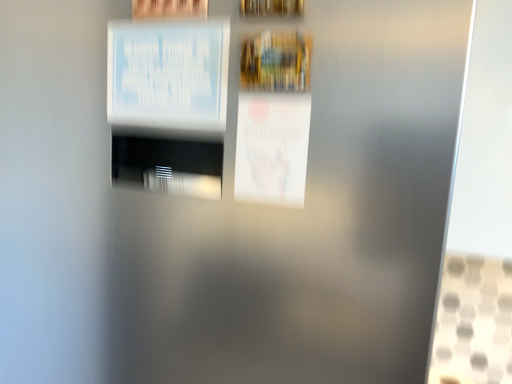
Question: Is wooden picture frame at upper center aimed at white paper poster at center, which appears as the second poster when viewed from the left?

Choices:
 (A) yes
 (B) no

Answer: (B)

Question: Could white paper poster at center, which appears as the second poster when viewed from the left, be considered to be inside wooden picture frame at upper center?

Choices:
 (A) yes
 (B) no

Answer: (B)

Question: Does wooden picture frame at upper center have a larger size compared to white paper poster at center, marked as the 1th poster in a bottom-to-top arrangement?

Choices:
 (A) no
 (B) yes

Answer: (A)

Question: Does wooden picture frame at upper center have a lesser height compared to white paper poster at center, which appears as the second poster when viewed from the left?

Choices:
 (A) no
 (B) yes

Answer: (B)

Question: From a real-world perspective, does wooden picture frame at upper center stand above white paper poster at center, which appears as the second poster when viewed from the left?

Choices:
 (A) yes
 (B) no

Answer: (A)

Question: From the image's perspective, is white paper poster at center, marked as the 1th poster in a bottom-to-top arrangement, above or below white paper at upper left, arranged as the second poster when ordered from the bottom?

Choices:
 (A) below
 (B) above

Answer: (A)

Question: From a real-world perspective, is white paper poster at center, which is counted as the first poster, starting from the right, positioned above or below white paper at upper left, the 1th poster positioned from the left?

Choices:
 (A) below
 (B) above

Answer: (A)

Question: Considering their positions, is white paper poster at center, which is counted as the first poster, starting from the right, located in front of or behind white paper at upper left, the first poster from the top?

Choices:
 (A) front
 (B) behind

Answer: (A)

Question: Looking at their shapes, would you say white paper poster at center, marked as the 1th poster in a bottom-to-top arrangement, is wider or thinner than white paper at upper left, the first poster from the top?

Choices:
 (A) thin
 (B) wide

Answer: (A)

Question: Is white paper poster at center, which is counted as the first poster, starting from the right, wider or thinner than wooden picture frame at upper center?

Choices:
 (A) thin
 (B) wide

Answer: (A)

Question: Considering their positions, is white paper poster at center, which is counted as the first poster, starting from the right, located in front of or behind wooden picture frame at upper center?

Choices:
 (A) front
 (B) behind

Answer: (B)

Question: Is point (243, 183) positioned closer to the camera than point (274, 3)?

Choices:
 (A) closer
 (B) farther

Answer: (B)

Question: From a real-world perspective, is white paper poster at center, which appears as the second poster when viewed from the left, physically located above or below wooden picture frame at upper center?

Choices:
 (A) below
 (B) above

Answer: (A)

Question: In terms of width, does wooden picture frame at upper center look wider or thinner when compared to white paper at upper left, the first poster from the top?

Choices:
 (A) thin
 (B) wide

Answer: (B)

Question: Would you say wooden picture frame at upper center is inside or outside white paper at upper left, arranged as the second poster when ordered from the bottom?

Choices:
 (A) outside
 (B) inside

Answer: (A)